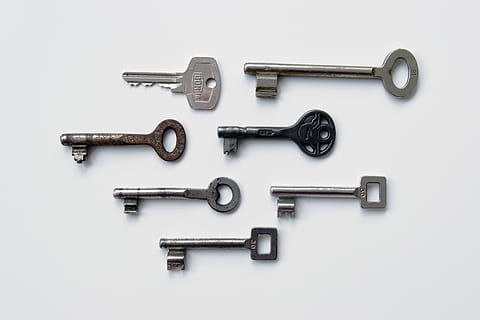
This screenshot has height=320, width=480. Find the location of `keys`. keys is located at coordinates (212, 87), (273, 72), (315, 121), (143, 138), (165, 190), (290, 193), (240, 241).